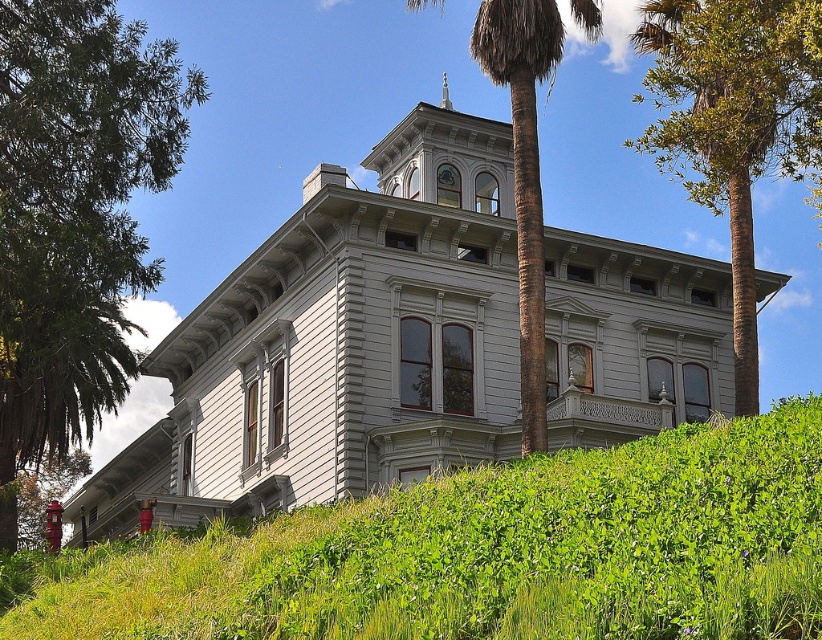
Which is more to the right, green leafy tree at left or brown textured palm tree at upper center?

Positioned to the right is brown textured palm tree at upper center.

Where is `green leafy tree at left`? green leafy tree at left is located at coordinates (74, 216).

The width and height of the screenshot is (822, 640). I want to click on green leafy tree at left, so pyautogui.click(x=74, y=216).

Which is above, green leafy palm at center or silver metallic spire at upper center?

silver metallic spire at upper center is above.

Describe the element at coordinates (733, 122) in the screenshot. I see `green leafy palm at center` at that location.

Image resolution: width=822 pixels, height=640 pixels. What are the coordinates of `green leafy palm at center` in the screenshot? It's located at point(733,122).

Between point (100, 604) and point (51, 243), which one is positioned behind?

Point (51, 243)

Is point (723, 556) farther from camera compared to point (135, 369)?

No, it is in front of (135, 369).

Between point (227, 560) and point (56, 422), which one is positioned in front?

Point (227, 560) is in front.

Image resolution: width=822 pixels, height=640 pixels. Identify the location of green leafy grass at lower center. (486, 552).